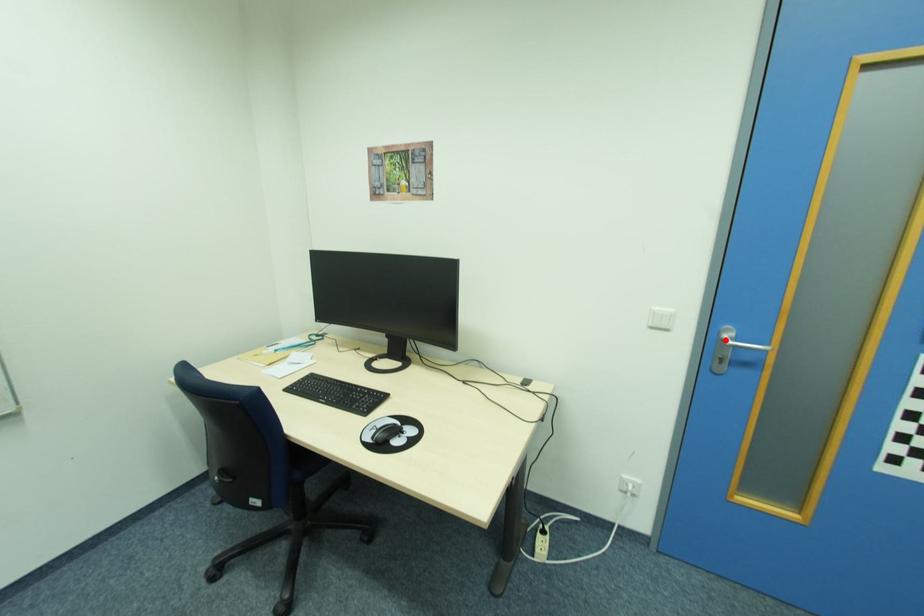
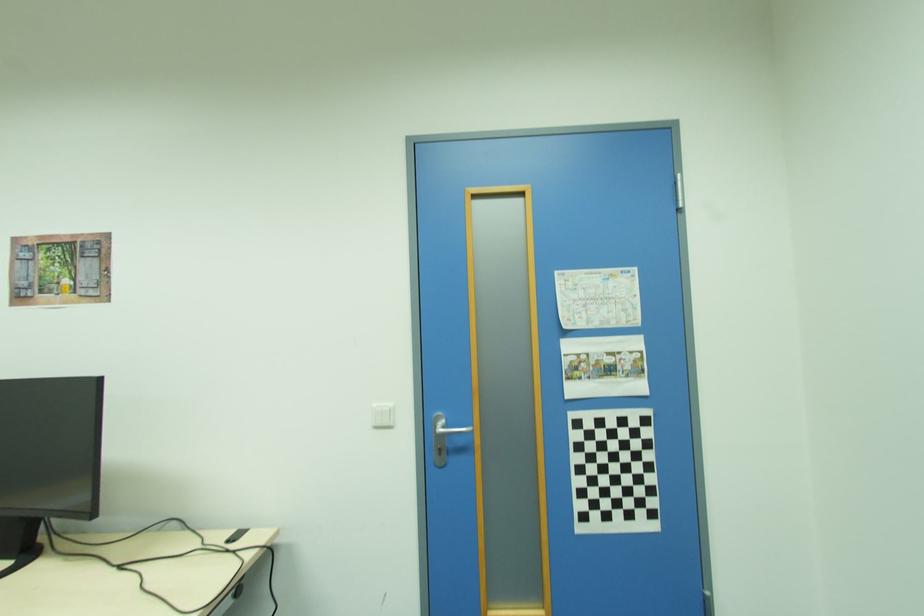
Where in the second image is the point corresponding to the highlighted location from the first image?

(439, 429)